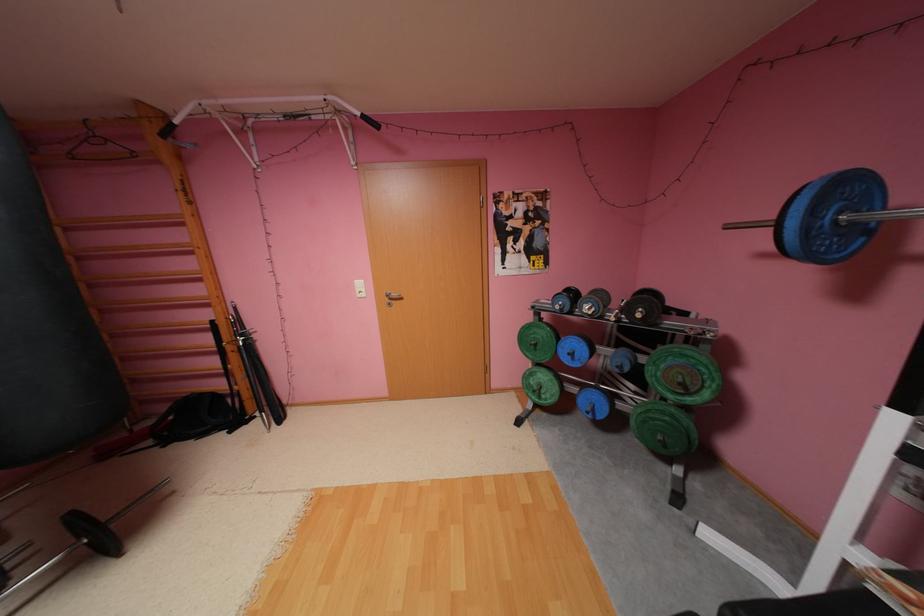
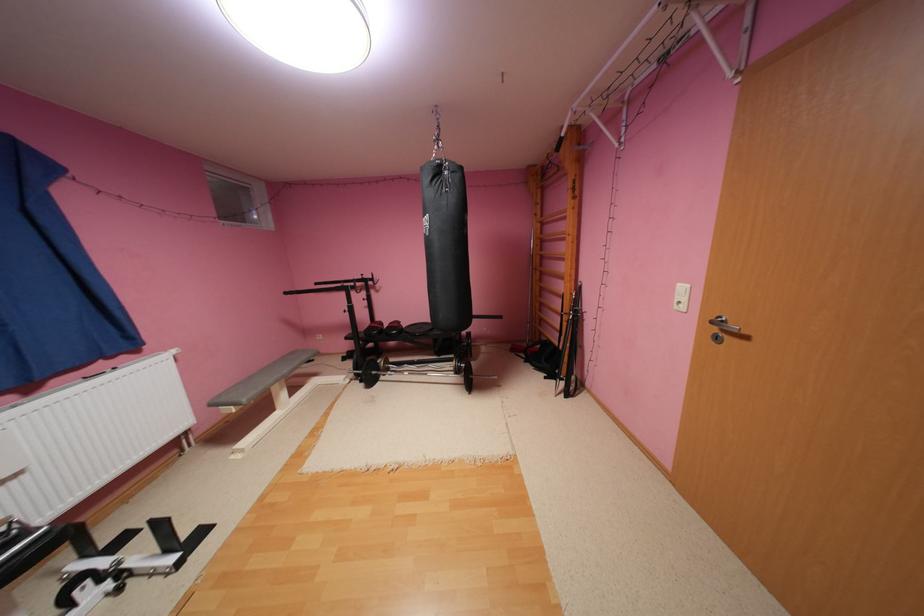
In the second image, find the point that corresponds to point (399, 299) in the first image.

(733, 330)